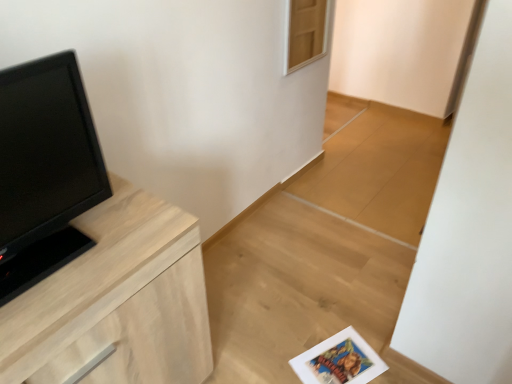
Identify the location of free region under black matte tv at left (from a real-world perspective). The height and width of the screenshot is (384, 512). (66, 242).